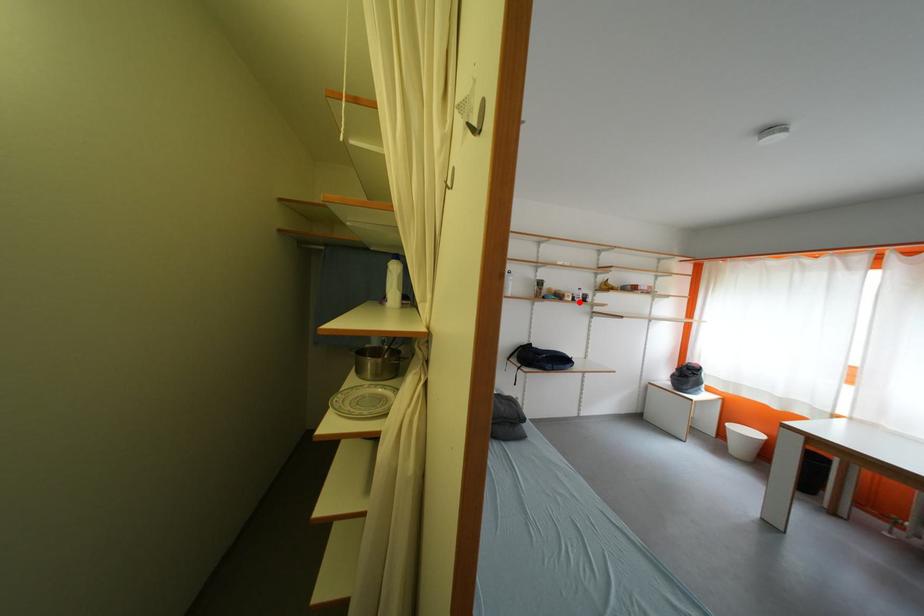
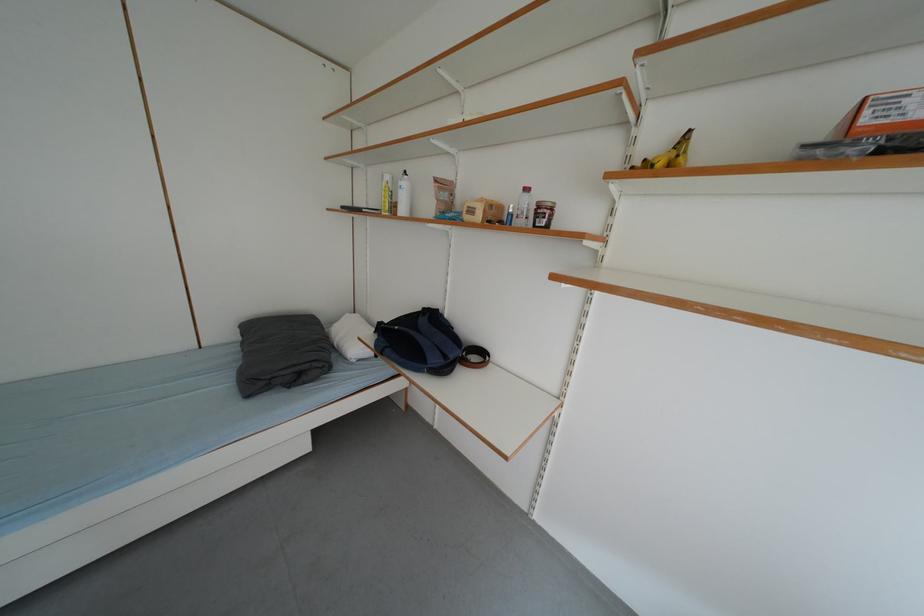
Locate, in the second image, the point that corresponds to the highlighted location in the first image.

(487, 220)